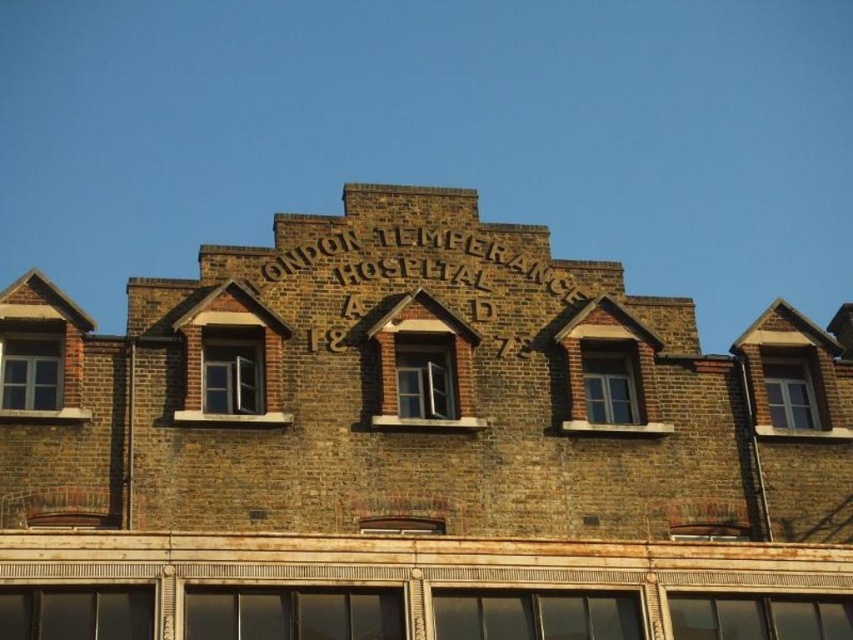
Looking at this image, you are standing in front of the London Temperance Hospital building. There are two points on the building facade labeled as point (210, 328) and point (813, 394). Which point is closer to you?

Point (210, 328) is closer to the viewer than point (813, 394).